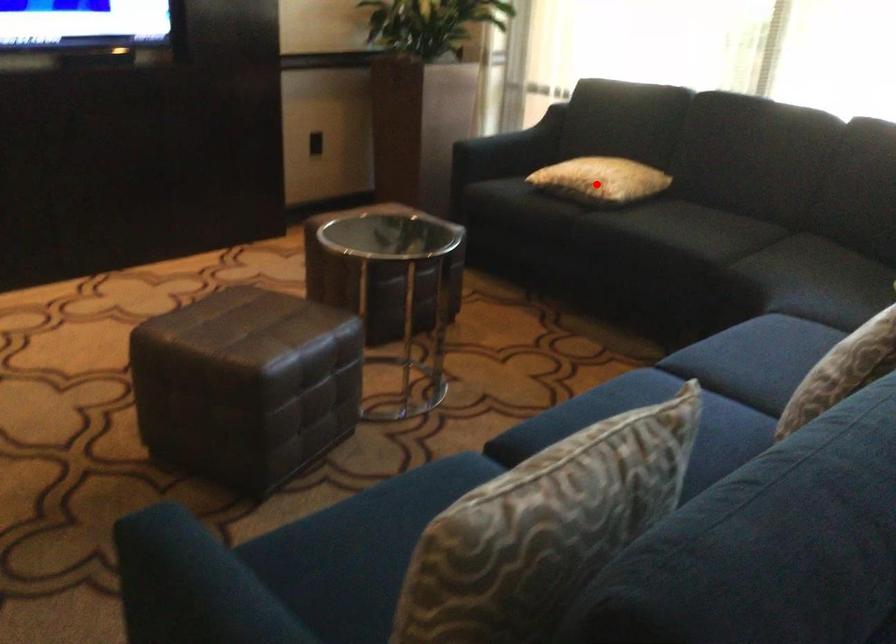
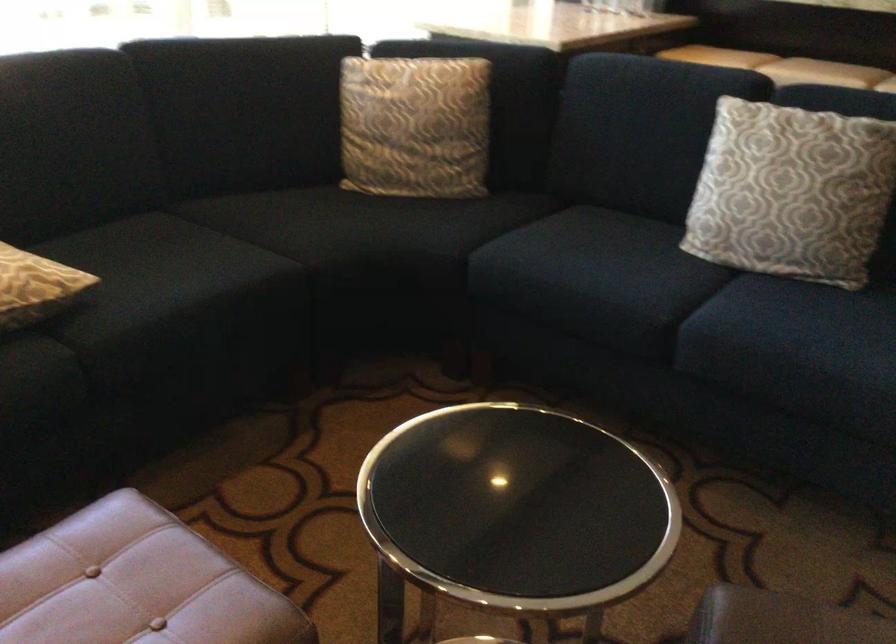
Locate, in the second image, the point that corresponds to the highlighted location in the first image.

(35, 287)